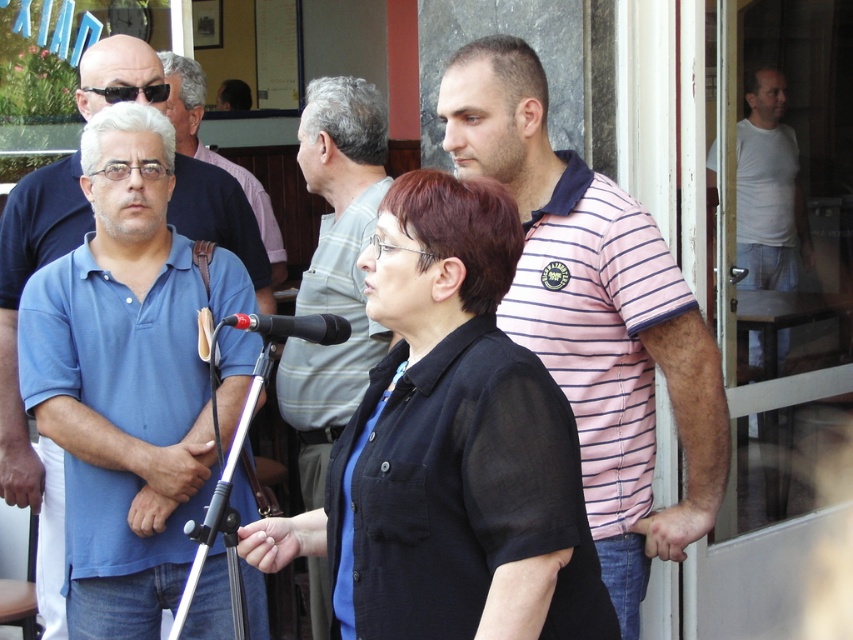
Is pink striped polo shirt at center shorter than white cotton shirt at right?

No.

Is pink striped polo shirt at center below white cotton shirt at right?

Correct, pink striped polo shirt at center is located below white cotton shirt at right.

Is point (550, 152) closer to camera compared to point (767, 177)?

Yes, point (550, 152) is closer to viewer.

Locate an element on the screen. This screenshot has height=640, width=853. pink striped polo shirt at center is located at coordinates 595,316.

Locate an element on the screen. Image resolution: width=853 pixels, height=640 pixels. black cotton shirt at center is located at coordinates (450, 448).

Between point (523, 360) and point (585, 472), which one is positioned in front?

Point (523, 360)

This screenshot has height=640, width=853. Identify the location of black cotton shirt at center. 450,448.

Based on the photo, between black cotton shirt at center and gray striped shirt at center, which one has more height?

Standing taller between the two is gray striped shirt at center.

Can you confirm if black cotton shirt at center is smaller than gray striped shirt at center?

Indeed, black cotton shirt at center has a smaller size compared to gray striped shirt at center.

Does point (444, 396) lie behind point (321, 257)?

No.

Where is `black cotton shirt at center`? The height and width of the screenshot is (640, 853). black cotton shirt at center is located at coordinates [450, 448].